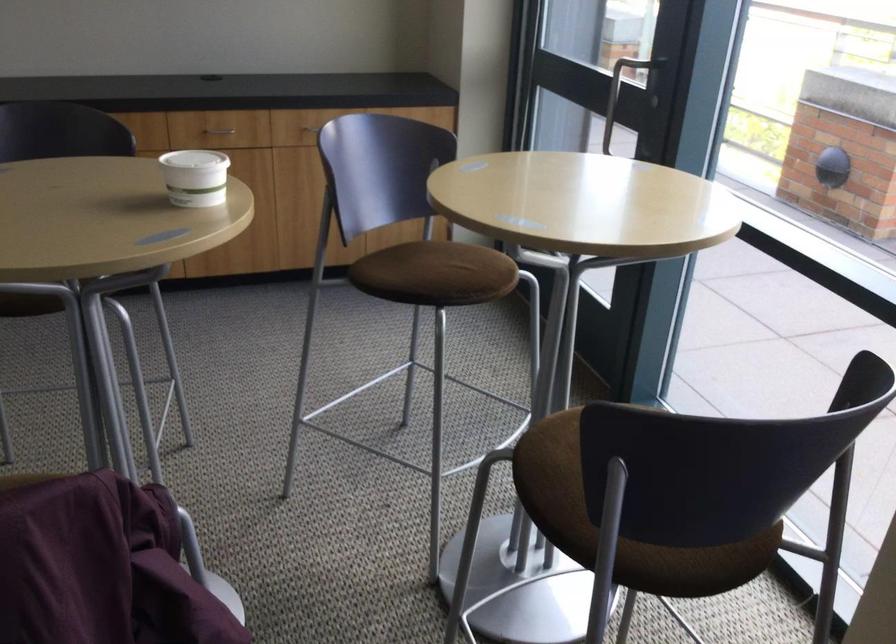
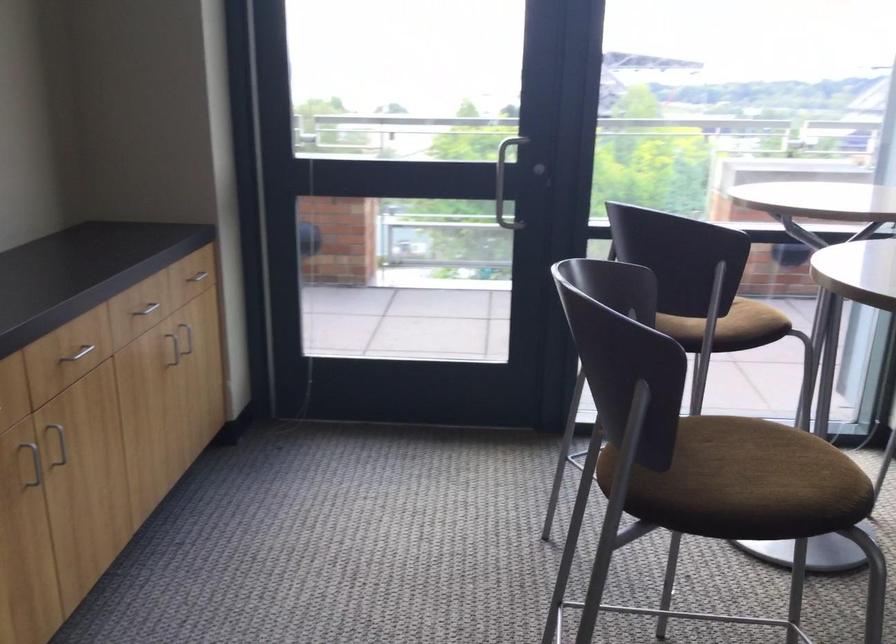
Find the pixel in the second image that matches point (263, 169) in the first image.

(57, 442)